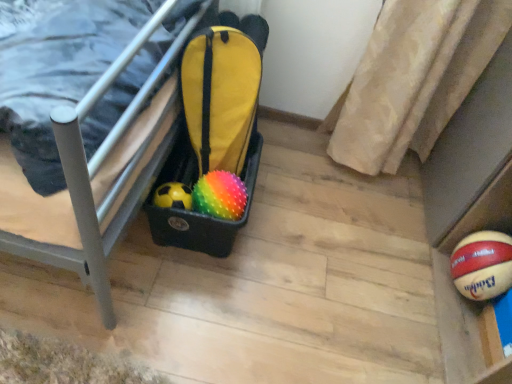
Identify the location of spongy multicolored ball at center. (220, 195).

What do you see at coordinates (220, 195) in the screenshot?
I see `spongy multicolored ball at center` at bounding box center [220, 195].

What is the approximate height of spongy multicolored ball at center?

5.00 inches.

The image size is (512, 384). Find the location of `black plastic storage bin at lower left`. black plastic storage bin at lower left is located at coordinates (96, 173).

This screenshot has height=384, width=512. What do you see at coordinates (96, 173) in the screenshot?
I see `black plastic storage bin at lower left` at bounding box center [96, 173].

In order to face black plastic storage bin at lower left, should I rotate leftwards or rightwards?

A 29.738 degree turn to the left will do.

This screenshot has width=512, height=384. In order to click on spongy multicolored ball at center in this screenshot , I will do (x=220, y=195).

Which is more to the right, spongy multicolored ball at center or black plastic storage bin at lower left?

spongy multicolored ball at center.

Considering the relative positions of spongy multicolored ball at center and black plastic storage bin at lower left in the image provided, is spongy multicolored ball at center behind black plastic storage bin at lower left?

That is True.

Which is behind, point (239, 213) or point (63, 263)?

Positioned behind is point (239, 213).

From the image's perspective, is spongy multicolored ball at center positioned above or below black plastic storage bin at lower left?

spongy multicolored ball at center is situated lower than black plastic storage bin at lower left in the image.

From a real-world perspective, between spongy multicolored ball at center and black plastic storage bin at lower left, who is vertically lower?

In real-world perspective, spongy multicolored ball at center is lower.

In terms of width, does spongy multicolored ball at center look wider or thinner when compared to black plastic storage bin at lower left?

Considering their sizes, spongy multicolored ball at center looks slimmer than black plastic storage bin at lower left.

Considering the relative sizes of spongy multicolored ball at center and black plastic storage bin at lower left in the image provided, is spongy multicolored ball at center taller than black plastic storage bin at lower left?

Incorrect, the height of spongy multicolored ball at center is not larger of that of black plastic storage bin at lower left.

Considering the sizes of objects spongy multicolored ball at center and black plastic storage bin at lower left in the image provided, who is smaller, spongy multicolored ball at center or black plastic storage bin at lower left?

With smaller size is spongy multicolored ball at center.

Would you say spongy multicolored ball at center is outside black plastic storage bin at lower left?

Absolutely, spongy multicolored ball at center is external to black plastic storage bin at lower left.

Is spongy multicolored ball at center placed right next to black plastic storage bin at lower left?

No, spongy multicolored ball at center is not making contact with black plastic storage bin at lower left.

Could you tell me if spongy multicolored ball at center is turned towards black plastic storage bin at lower left?

No, spongy multicolored ball at center does not turn towards black plastic storage bin at lower left.

How different are the orientations of spongy multicolored ball at center and black plastic storage bin at lower left in degrees?

92.8 degrees separate the facing orientations of spongy multicolored ball at center and black plastic storage bin at lower left.

You are a GUI agent. You are given a task and a screenshot of the screen. Output one action in this format:
    pyautogui.click(x=<x>, y=<y>)
    Task: Click on the furniture on the left of spongy multicolored ball at center
    The image size is (512, 384).
    Given the screenshot: What is the action you would take?
    pyautogui.click(x=96, y=173)

Which is more to the right, black plastic storage bin at lower left or spongy multicolored ball at center?

spongy multicolored ball at center.

Between black plastic storage bin at lower left and spongy multicolored ball at center, which one is positioned in front?

black plastic storage bin at lower left is more forward.

Which is farther, (x=106, y=242) or (x=230, y=179)?

Point (x=230, y=179)

From the image's perspective, is black plastic storage bin at lower left positioned above or below spongy multicolored ball at center?

Based on their image positions, black plastic storage bin at lower left is located above spongy multicolored ball at center.

From a real-world perspective, is black plastic storage bin at lower left located higher than spongy multicolored ball at center?

Indeed, from a real-world perspective, black plastic storage bin at lower left stands above spongy multicolored ball at center.

Considering the relative sizes of black plastic storage bin at lower left and spongy multicolored ball at center in the image provided, is black plastic storage bin at lower left thinner than spongy multicolored ball at center?

No, black plastic storage bin at lower left is not thinner than spongy multicolored ball at center.

Does black plastic storage bin at lower left have a lesser height compared to spongy multicolored ball at center?

In fact, black plastic storage bin at lower left may be taller than spongy multicolored ball at center.

Does black plastic storage bin at lower left have a smaller size compared to spongy multicolored ball at center?

Incorrect, black plastic storage bin at lower left is not smaller in size than spongy multicolored ball at center.

Would you say black plastic storage bin at lower left contains spongy multicolored ball at center?

No, spongy multicolored ball at center is not inside black plastic storage bin at lower left.

Are black plastic storage bin at lower left and spongy multicolored ball at center beside each other?

black plastic storage bin at lower left and spongy multicolored ball at center are clearly separated.

Is black plastic storage bin at lower left positioned with its back to spongy multicolored ball at center?

No, black plastic storage bin at lower left's orientation is not away from spongy multicolored ball at center.

How distant is black plastic storage bin at lower left from spongy multicolored ball at center?

black plastic storage bin at lower left and spongy multicolored ball at center are 11.38 inches apart.

At what (x,y) coordinates should I click in order to perform the action: click on ball below the black plastic storage bin at lower left (from the image's perspective). Please return your answer as a coordinate pair (x, y). Looking at the image, I should click on (220, 195).

In order to click on furniture in front of the spongy multicolored ball at center in this screenshot , I will do `click(96, 173)`.

Image resolution: width=512 pixels, height=384 pixels. What are the coordinates of `furniture that appears above the spongy multicolored ball at center (from a real-world perspective)` in the screenshot? It's located at (96, 173).